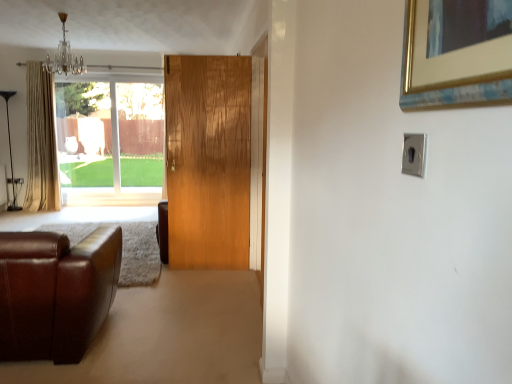
Question: Does beige fabric curtain at left appear on the left side of brown leather couch at lower left?

Choices:
 (A) no
 (B) yes

Answer: (B)

Question: Is beige fabric curtain at left smaller than brown leather couch at lower left?

Choices:
 (A) yes
 (B) no

Answer: (A)

Question: Would you say beige fabric curtain at left is a long distance from brown leather couch at lower left?

Choices:
 (A) yes
 (B) no

Answer: (A)

Question: From the image's perspective, is beige fabric curtain at left under brown leather couch at lower left?

Choices:
 (A) no
 (B) yes

Answer: (A)

Question: Can you confirm if beige fabric curtain at left is thinner than brown leather couch at lower left?

Choices:
 (A) no
 (B) yes

Answer: (B)

Question: Looking at the image, does beige fabric curtain at left seem bigger or smaller compared to wooden door at center?

Choices:
 (A) small
 (B) big

Answer: (B)

Question: Is beige fabric curtain at left taller or shorter than wooden door at center?

Choices:
 (A) tall
 (B) short

Answer: (A)

Question: In the image, is beige fabric curtain at left positioned in front of or behind wooden door at center?

Choices:
 (A) behind
 (B) front

Answer: (A)

Question: Considering the positions of beige fabric curtain at left and wooden door at center in the image, is beige fabric curtain at left wider or thinner than wooden door at center?

Choices:
 (A) wide
 (B) thin

Answer: (A)

Question: From a real-world perspective, relative to wooden door at center, is satin silver switch at upper right vertically above or below?

Choices:
 (A) above
 (B) below

Answer: (A)

Question: Considering the relative positions of satin silver switch at upper right and wooden door at center in the image provided, is satin silver switch at upper right to the left or to the right of wooden door at center?

Choices:
 (A) right
 (B) left

Answer: (A)

Question: In terms of size, does satin silver switch at upper right appear bigger or smaller than wooden door at center?

Choices:
 (A) small
 (B) big

Answer: (A)

Question: Is satin silver switch at upper right in front of or behind wooden door at center in the image?

Choices:
 (A) behind
 (B) front

Answer: (B)

Question: Relative to satin silver switch at upper right, is beige fabric curtain at left in front or behind?

Choices:
 (A) front
 (B) behind

Answer: (B)

Question: Based on their positions, is beige fabric curtain at left located to the left or right of satin silver switch at upper right?

Choices:
 (A) right
 (B) left

Answer: (B)